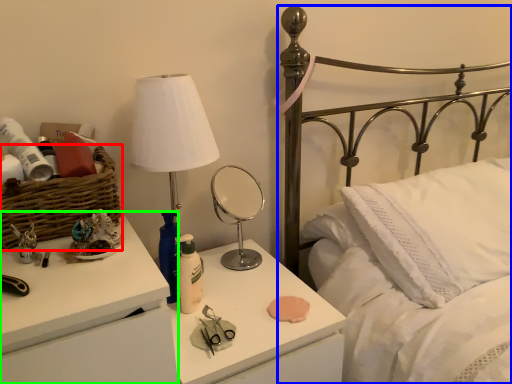
Question: Considering the real-world distances, which object is closest to basket (highlighted by a red box)? bed (highlighted by a blue box) or nightstand (highlighted by a green box).

Choices:
 (A) bed
 (B) nightstand

Answer: (B)